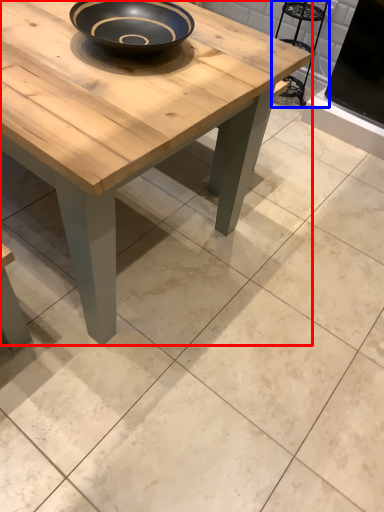
Question: Which point is closer to the camera, coffee table (highlighted by a red box) or chair (highlighted by a blue box)?

Choices:
 (A) coffee table
 (B) chair

Answer: (A)